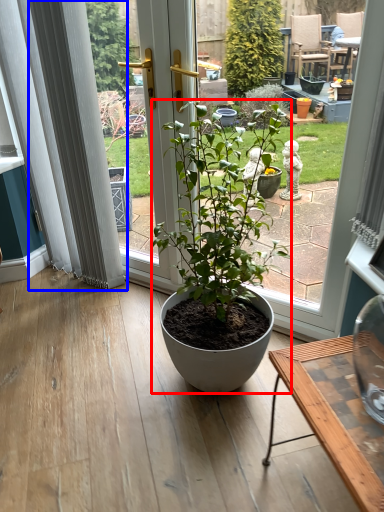
Question: Which object appears farthest to the camera in this image, houseplant (highlighted by a red box) or curtain (highlighted by a blue box)?

Choices:
 (A) houseplant
 (B) curtain

Answer: (B)